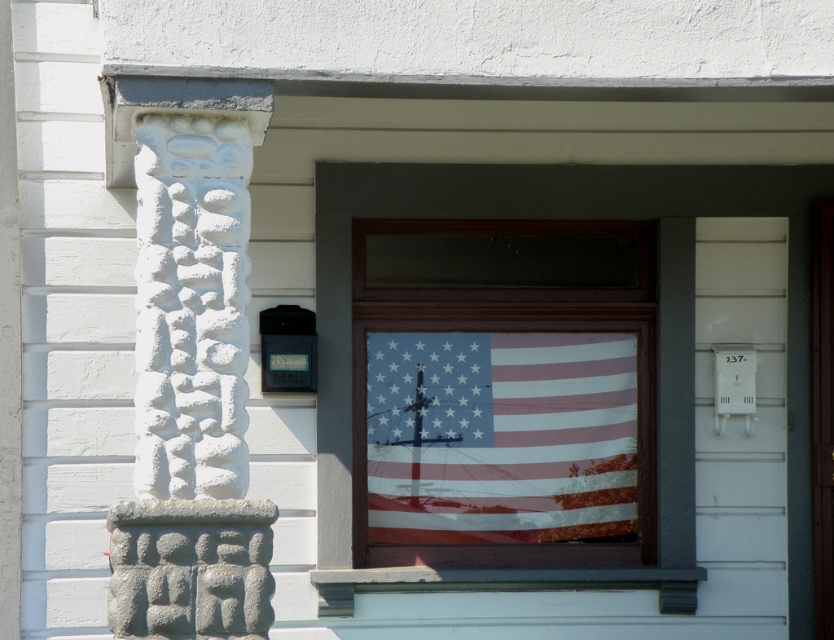
Question: Can you confirm if matte paper flag at center is positioned to the left of american flag at center?

Choices:
 (A) yes
 (B) no

Answer: (A)

Question: Does white stone carving at left appear over matte paper flag at center?

Choices:
 (A) no
 (B) yes

Answer: (B)

Question: Which object is positioned farthest from the white stone carving at left?

Choices:
 (A) american flag at center
 (B) matte paper flag at center

Answer: (B)

Question: Does white stone carving at left have a lesser width compared to american flag at center?

Choices:
 (A) no
 (B) yes

Answer: (B)

Question: Which object appears closest to the camera in this image?

Choices:
 (A) matte paper flag at center
 (B) american flag at center
 (C) white stone carving at left

Answer: (C)

Question: Which point is farther from the camera taking this photo?

Choices:
 (A) (182, 582)
 (B) (409, 413)
 (C) (661, 513)

Answer: (B)